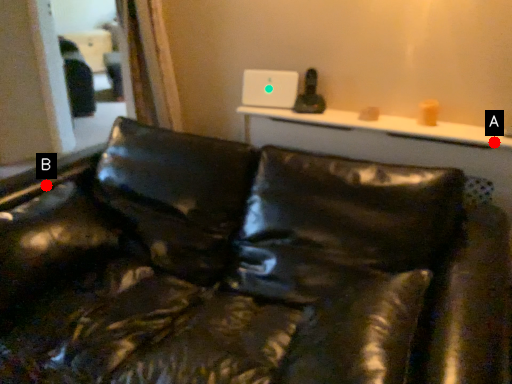
Question: Two points are circled on the image, labeled by A and B beside each circle. Which point is further to the camera?

Choices:
 (A) A is further
 (B) B is further

Answer: (B)